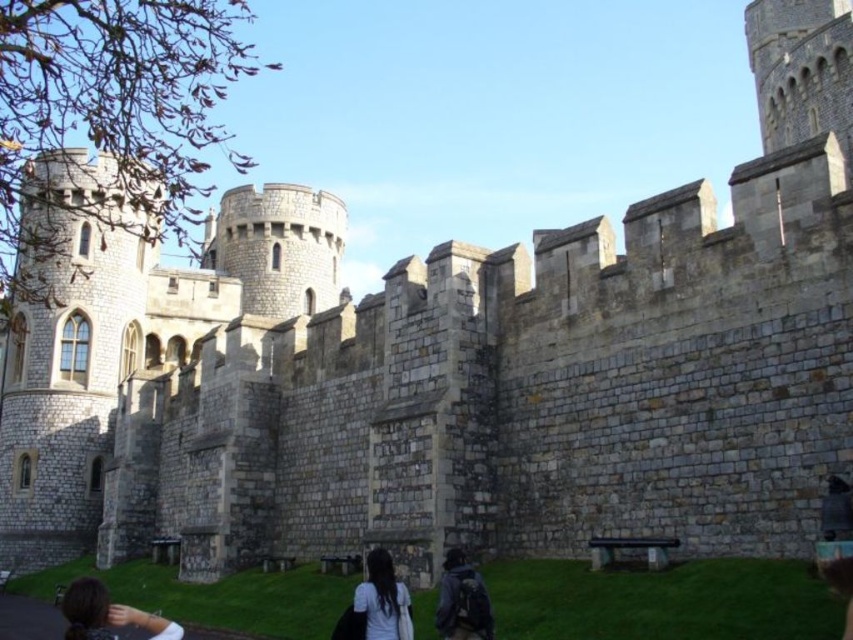
Question: Is dark brown hair at lower left in front of white matte shirt at lower center?

Choices:
 (A) yes
 (B) no

Answer: (A)

Question: Which object is positioned farthest from the white matte shirt at lower center?

Choices:
 (A) dark gray backpack at lower center
 (B) dark brown hair at lower left

Answer: (B)

Question: Estimate the real-world distances between objects in this image. Which object is closer to the dark brown hair at lower left?

Choices:
 (A) white matte shirt at lower center
 (B) dark gray backpack at lower center

Answer: (A)

Question: Can you confirm if dark brown hair at lower left is positioned to the right of white matte shirt at lower center?

Choices:
 (A) yes
 (B) no

Answer: (B)

Question: Is dark brown hair at lower left closer to camera compared to white matte shirt at lower center?

Choices:
 (A) yes
 (B) no

Answer: (A)

Question: Which of the following is the farthest from the observer?

Choices:
 (A) white matte shirt at lower center
 (B) dark gray backpack at lower center

Answer: (B)